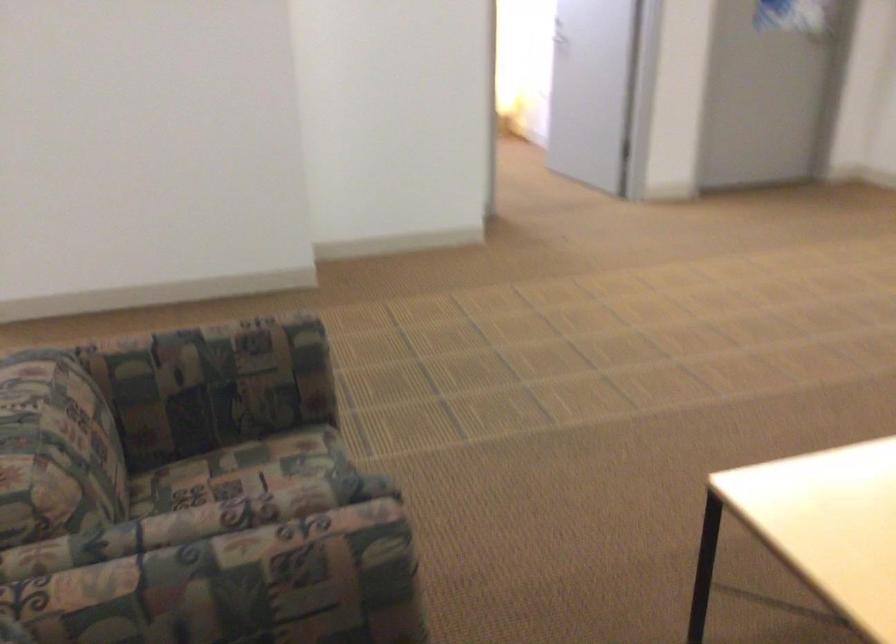
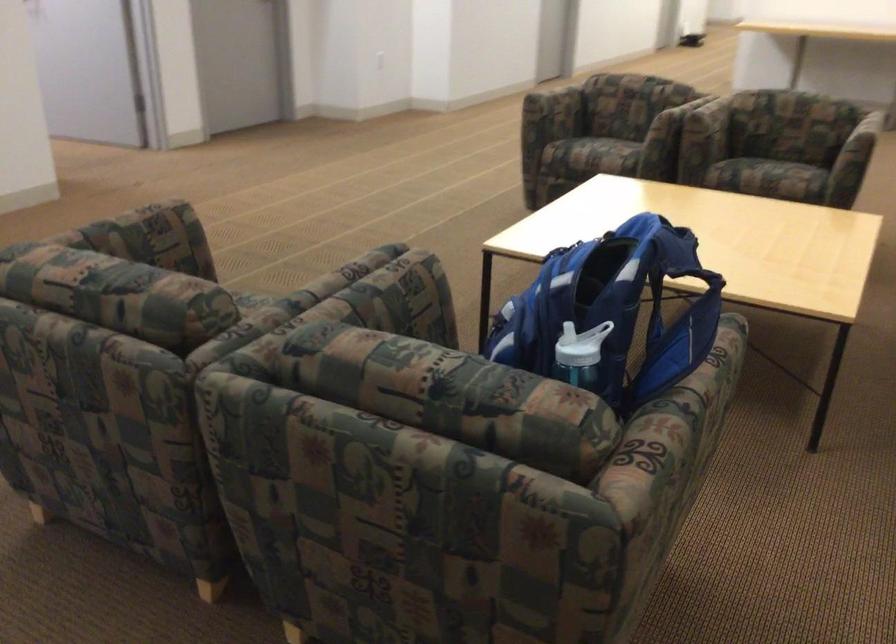
Question: I am providing you with two images of the same scene from different viewpoints. After the viewpoint changes to image2, which objects are now occluded?

Choices:
 (A) blue backpack handle
 (B) sofa sitting surface
 (C) chair armrest
 (D) blue laptop

Answer: (B)